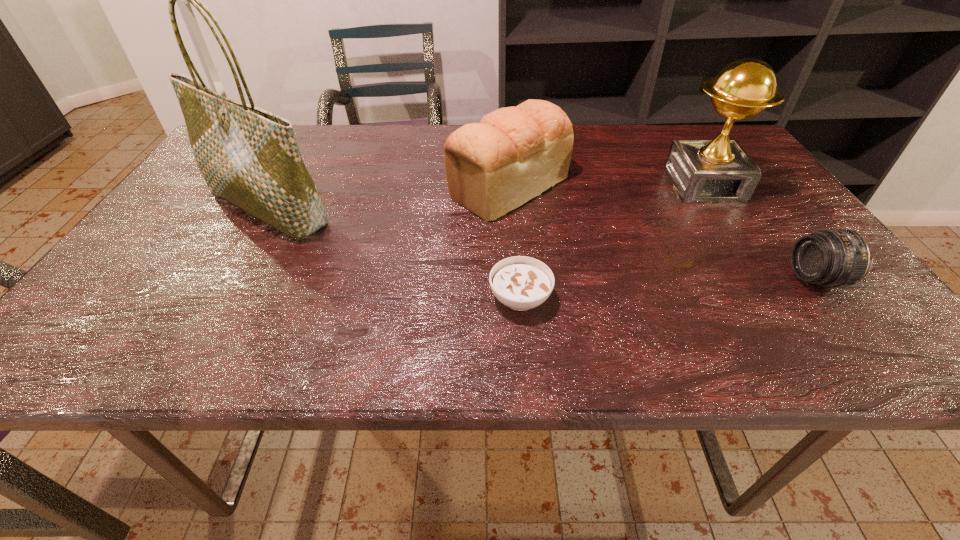
This screenshot has width=960, height=540. Find the location of `the tallest object`. the tallest object is located at coordinates (249, 157).

Find the location of `shopping bag`. shopping bag is located at coordinates (249, 157).

Identify the location of the second tallest object. The image size is (960, 540). (718, 170).

The image size is (960, 540). I want to click on the third shortest object, so click(x=513, y=154).

Image resolution: width=960 pixels, height=540 pixels. I want to click on telephoto lens, so click(837, 257).

In order to click on the shortest object in this screenshot , I will do `click(521, 283)`.

Where is `vacant space located 0.070m on the right of the shopping bag`? vacant space located 0.070m on the right of the shopping bag is located at coordinates (370, 208).

Image resolution: width=960 pixels, height=540 pixels. What are the coordinates of `vacant space located 0.070m on the front-facing side of the award` in the screenshot? It's located at pos(728,222).

Identify the location of free region located on the back of the third tallest object. (506, 144).

Identify the location of blank area located at the front element of the telephoto lens. The width and height of the screenshot is (960, 540). (742, 279).